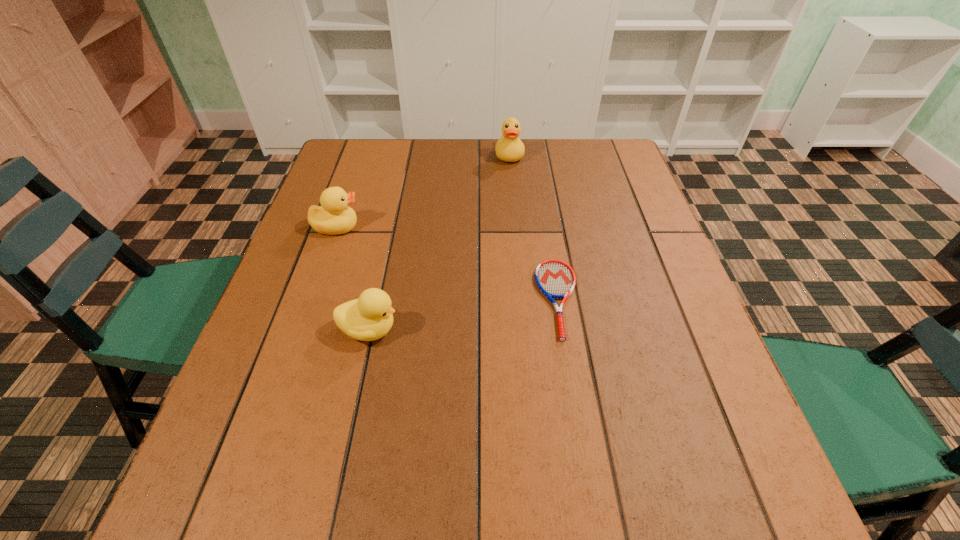
Identify the location of free region located 0.300m on the back of the shortest object. (540, 189).

Find the location of a particular element. object that is at the far edge is located at coordinates (509, 148).

Identify the location of free space at the far edge of the desktop. Image resolution: width=960 pixels, height=540 pixels. (418, 147).

Where is `free region at the right edge of the desktop`? free region at the right edge of the desktop is located at coordinates (669, 413).

The width and height of the screenshot is (960, 540). In the image, there is a desktop. Find the location of `free space at the far left corner`. free space at the far left corner is located at coordinates (374, 141).

In the image, there is a desktop. Identify the location of vacant space at the far right corner. (630, 165).

Find the location of a particular element. free space between the second object from left to right and the farthest duck is located at coordinates (440, 242).

Locate an element on the screen. This screenshot has width=960, height=540. free space between the third object from right to left and the farthest duck is located at coordinates (440, 242).

Locate an element on the screen. This screenshot has height=540, width=960. vacant area that lies between the third nearest object and the tennis racket is located at coordinates (447, 263).

At what (x,y) coordinates should I click in order to perform the action: click on vacant area that lies between the second farthest object and the rightmost duck. Please return your answer as a coordinate pair (x, y). Image resolution: width=960 pixels, height=540 pixels. Looking at the image, I should click on (423, 191).